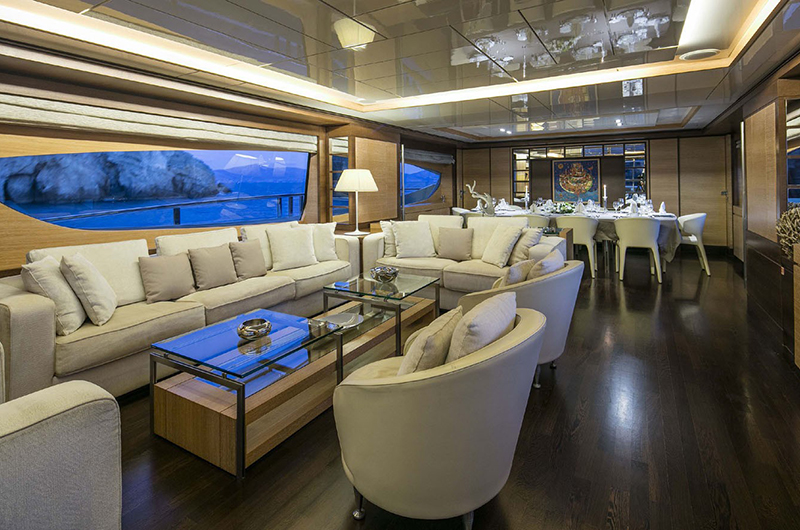
Where is `glass`? The image size is (800, 530). glass is located at coordinates (237, 198).